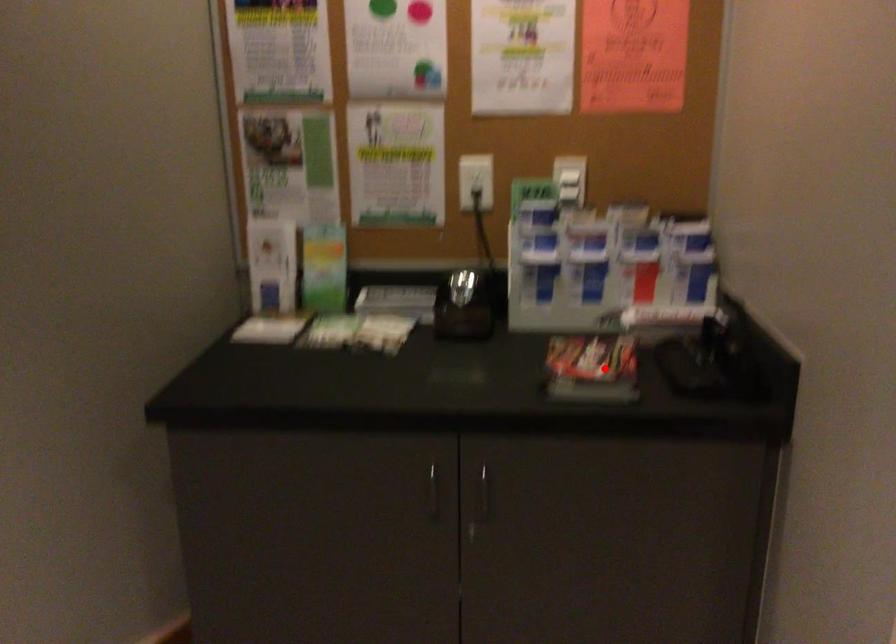
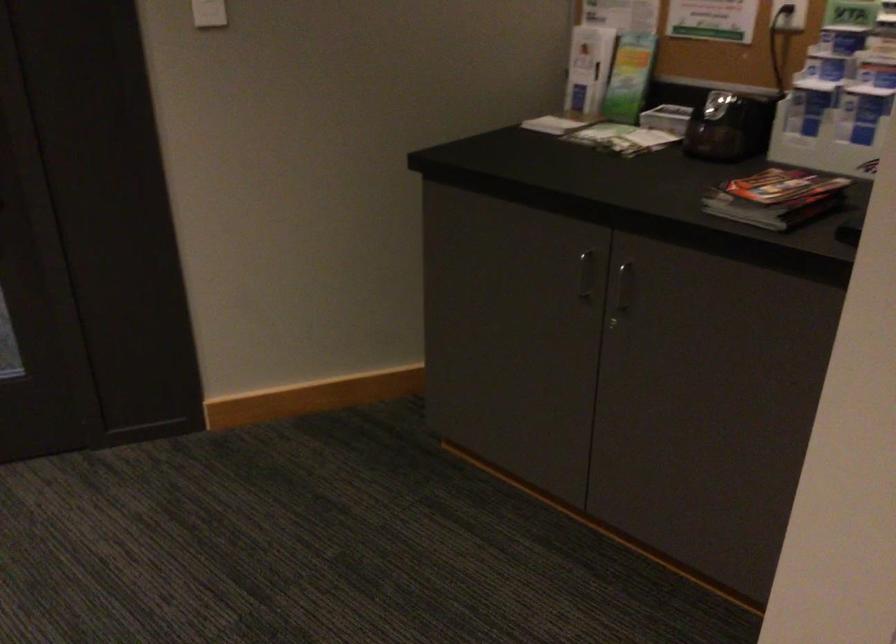
The point at the highlighted location is marked in the first image. Where is the corresponding point in the second image?

(776, 198)